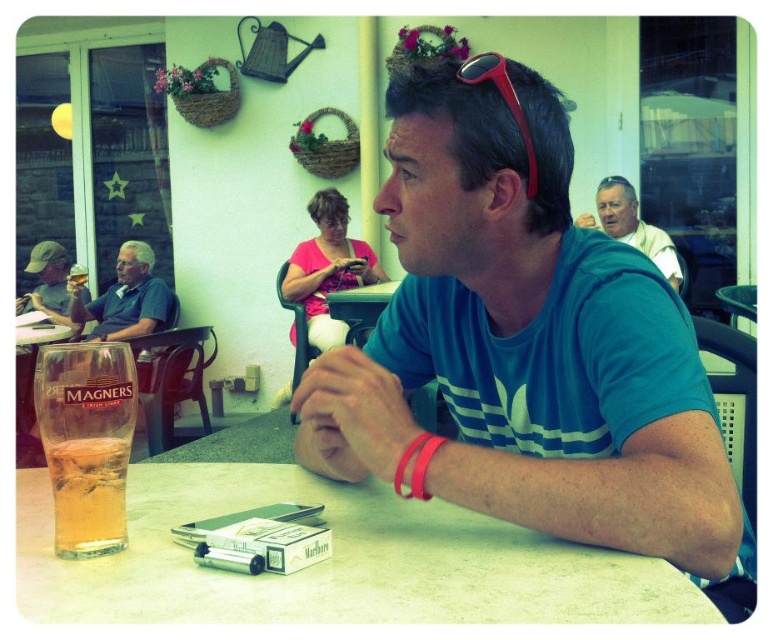
Does blue cotton shirt at upper left appear on the right side of matte gray cap at left?

Yes, blue cotton shirt at upper left is to the right of matte gray cap at left.

Does blue cotton shirt at upper left have a greater width compared to matte gray cap at left?

In fact, blue cotton shirt at upper left might be narrower than matte gray cap at left.

Locate an element on the screen. This screenshot has width=773, height=640. blue cotton shirt at upper left is located at coordinates (126, 298).

Where is `blue cotton shirt at upper left`? The height and width of the screenshot is (640, 773). blue cotton shirt at upper left is located at coordinates (126, 298).

At what (x,y) coordinates should I click in order to perform the action: click on translucent glass at lower left. Please return your answer as a coordinate pair (x, y). Image resolution: width=773 pixels, height=640 pixels. Looking at the image, I should click on (87, 493).

Based on the photo, does translucent glass at lower left have a smaller size compared to white textured shirt at upper right?

Indeed, translucent glass at lower left has a smaller size compared to white textured shirt at upper right.

Who is more forward, [67,448] or [608,196]?

Positioned in front is point [67,448].

You are a GUI agent. You are given a task and a screenshot of the screen. Output one action in this format:
    pyautogui.click(x=<x>, y=<y>)
    Task: Click on the translucent glass at lower left
    The height and width of the screenshot is (640, 773).
    Given the screenshot: What is the action you would take?
    pyautogui.click(x=87, y=493)

Is blue cotton shirt at upper left taller than white textured shirt at upper right?

In fact, blue cotton shirt at upper left may be shorter than white textured shirt at upper right.

What do you see at coordinates (126, 298) in the screenshot? Image resolution: width=773 pixels, height=640 pixels. I see `blue cotton shirt at upper left` at bounding box center [126, 298].

Where is `blue cotton shirt at upper left`? blue cotton shirt at upper left is located at coordinates (126, 298).

The image size is (773, 640). What are the coordinates of `blue cotton shirt at upper left` in the screenshot? It's located at coord(126,298).